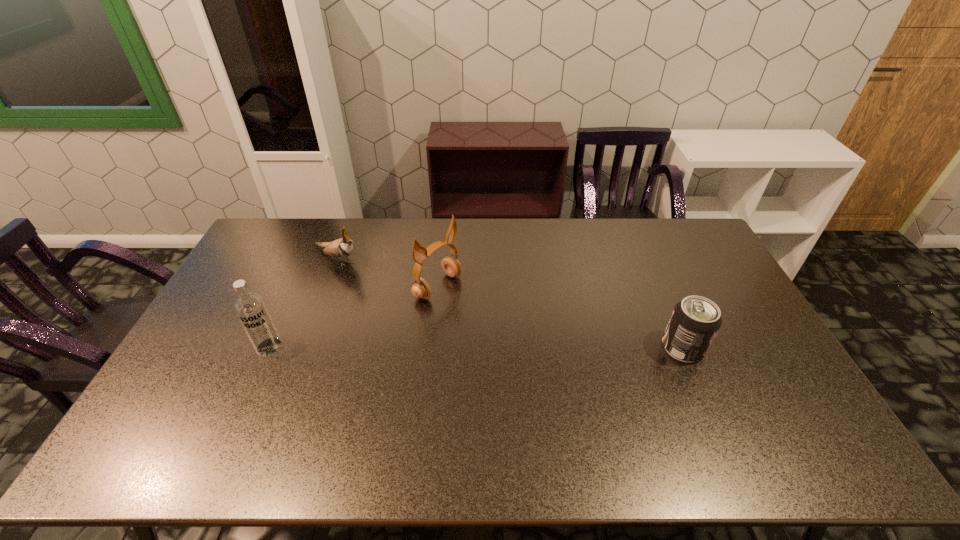
Identify which object is the closest to the earphone. Please provide its 2D coordinates. Your answer should be formatted as a tuple, i.e. [(x, y)], where the tuple contains the x and y coordinates of a point satisfying the conditions above.

[(341, 248)]

At what (x,y) coordinates should I click in order to perform the action: click on vacant space that satisfies the following two spatial constraints: 1. on the front side of the earphone; 2. on the left side of the rightmost object. Please return your answer as a coordinate pair (x, y). This screenshot has width=960, height=540. Looking at the image, I should click on click(x=431, y=348).

You are a GUI agent. You are given a task and a screenshot of the screen. Output one action in this format:
    pyautogui.click(x=<x>, y=<y>)
    Task: Click on the vacant space that satisfies the following two spatial constraints: 1. on the front label of the vodka; 2. on the left side of the soda can
    The height and width of the screenshot is (540, 960).
    Given the screenshot: What is the action you would take?
    pyautogui.click(x=269, y=348)

Locate an element on the screen. Image resolution: width=960 pixels, height=540 pixels. vacant space that satisfies the following two spatial constraints: 1. on the front label of the rightmost object; 2. on the right side of the vodka is located at coordinates pyautogui.click(x=269, y=348).

This screenshot has height=540, width=960. Find the location of `free region that satisfies the following two spatial constraints: 1. on the front side of the earphone; 2. on the left side of the bird`. free region that satisfies the following two spatial constraints: 1. on the front side of the earphone; 2. on the left side of the bird is located at coordinates (326, 287).

I want to click on vacant region that satisfies the following two spatial constraints: 1. on the front label of the rightmost object; 2. on the right side of the vodka, so click(269, 348).

I want to click on vacant space that satisfies the following two spatial constraints: 1. on the front label of the vodka; 2. on the right side of the soda can, so click(x=269, y=348).